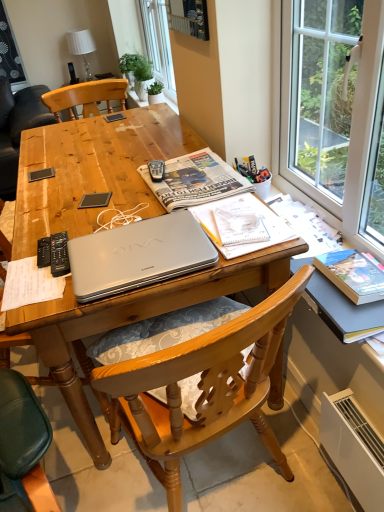
Locate an element on the screen. free location in front of black plastic remote control at left, positioned as the 2th remote control in left-to-right order is located at coordinates (40, 289).